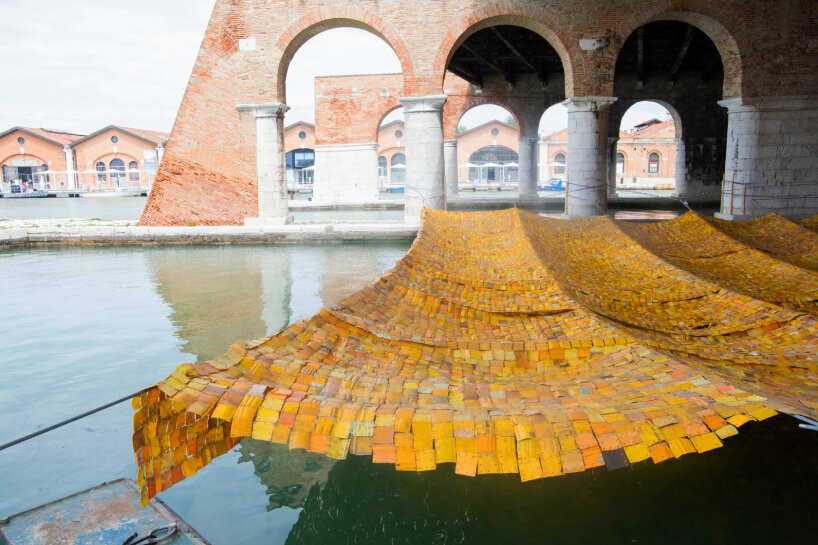
You are a GUI agent. You are given a task and a screenshot of the screen. Output one action in this format:
    pyautogui.click(x=<x>, y=<y>)
    Task: Click on the circular windows
    This screenshot has width=818, height=545.
    Given the screenshot: What is the action you would take?
    pyautogui.click(x=114, y=140), pyautogui.click(x=20, y=142), pyautogui.click(x=303, y=137), pyautogui.click(x=397, y=132), pyautogui.click(x=495, y=134)